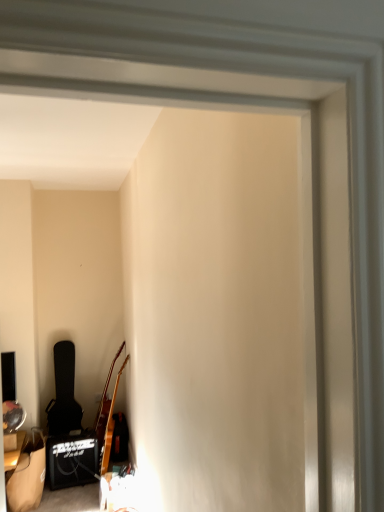
Question: Considering the positions of wooden acoustic guitar at lower left and black textured guitar case at left in the image, is wooden acoustic guitar at lower left bigger or smaller than black textured guitar case at left?

Choices:
 (A) small
 (B) big

Answer: (A)

Question: Which is correct: wooden acoustic guitar at lower left is inside black textured guitar case at left, or outside of it?

Choices:
 (A) inside
 (B) outside

Answer: (B)

Question: Considering their positions, is wooden acoustic guitar at lower left located in front of or behind black textured guitar case at left?

Choices:
 (A) behind
 (B) front

Answer: (B)

Question: From the image's perspective, is black textured guitar case at left located above or below wooden acoustic guitar at lower left?

Choices:
 (A) below
 (B) above

Answer: (B)

Question: Does point (51, 426) appear closer or farther from the camera than point (114, 382)?

Choices:
 (A) farther
 (B) closer

Answer: (A)

Question: Is black textured guitar case at left bigger or smaller than wooden acoustic guitar at lower left?

Choices:
 (A) big
 (B) small

Answer: (A)

Question: Relative to wooden acoustic guitar at lower left, is black textured guitar case at left in front or behind?

Choices:
 (A) behind
 (B) front

Answer: (A)